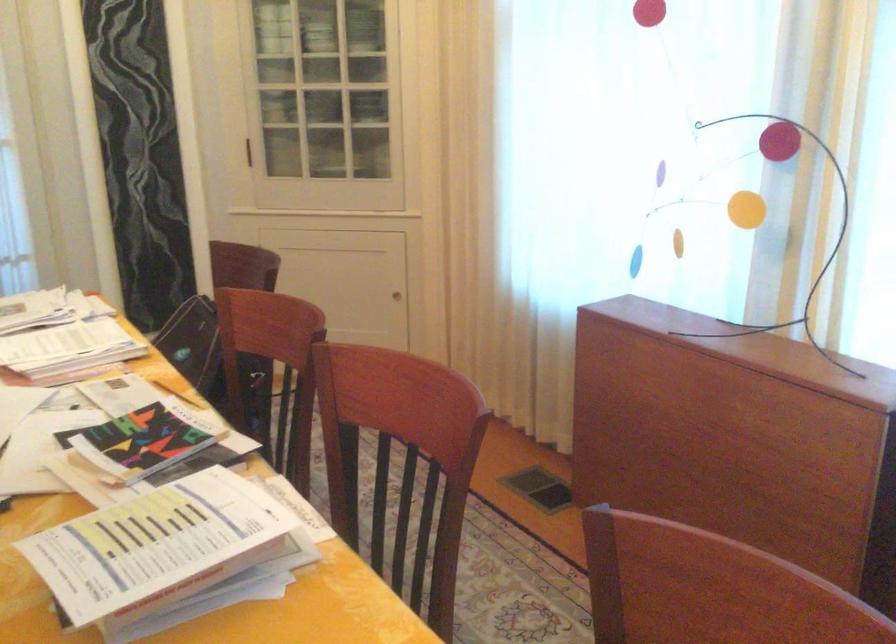
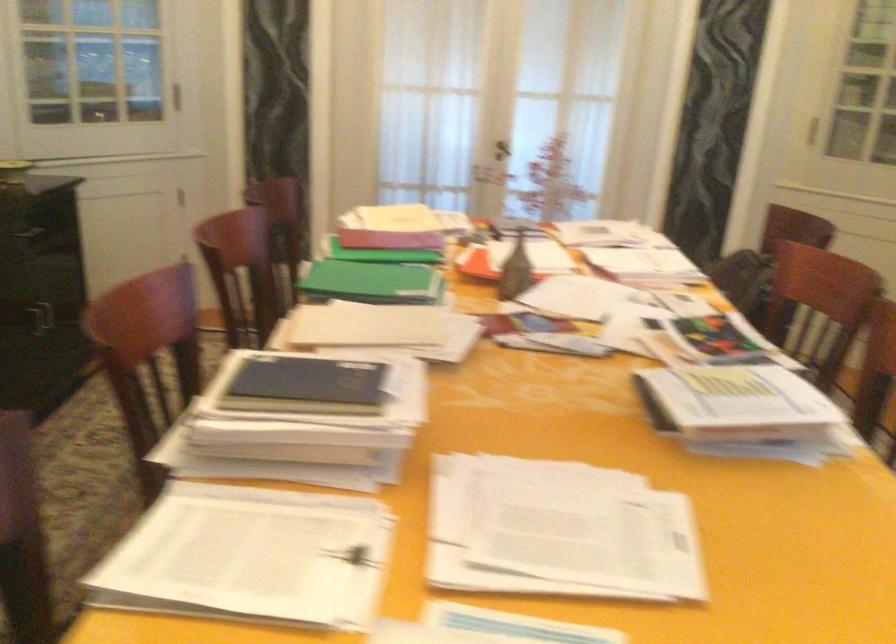
Question: The first image is from the beginning of the video and the second image is from the end. How did the camera likely rotate when shooting the video?

Choices:
 (A) Left
 (B) Right
 (C) Up
 (D) Down

Answer: (A)